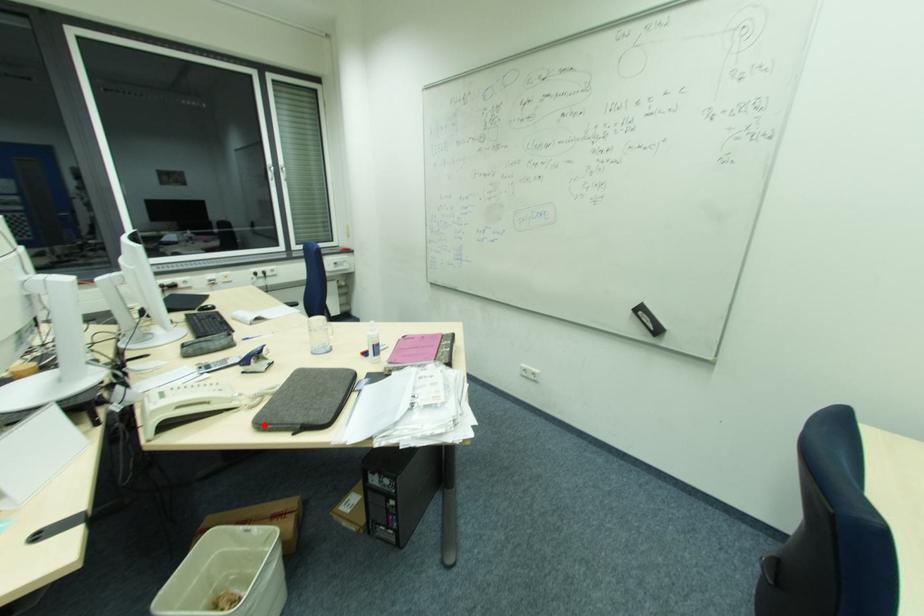
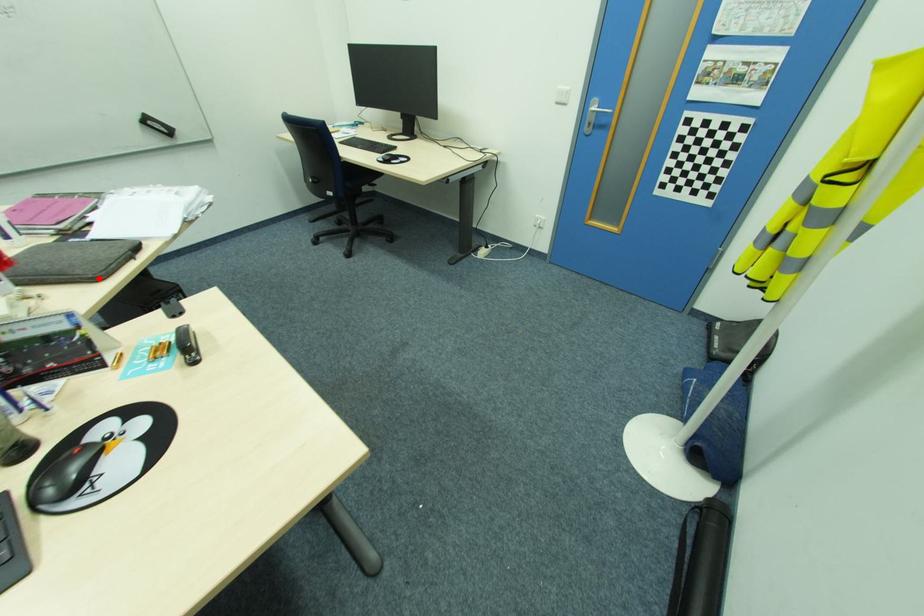
I am providing you with two images of the same scene from different viewpoints. A red point is marked on the first image and another point is marked on the second image. Do the highlighted points in image1 and image2 indicate the same real-world spot?

Yes